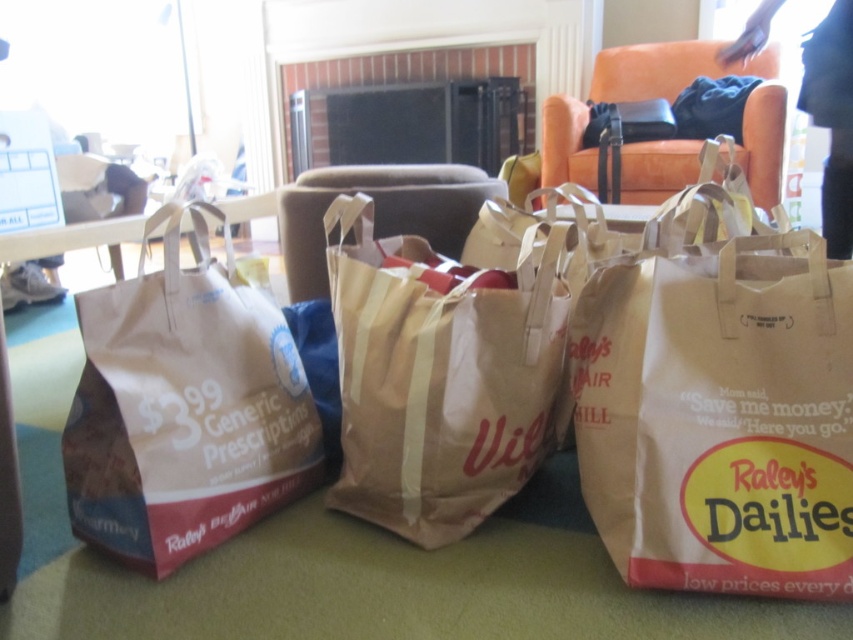
You are standing in the living room and see the brown paper bag at left. Can you tell me its exact position in the image?

The brown paper bag at left is located at the 2D coordinates of point (184, 404).

You are standing in a living room with two grocery bags on the green carpeted floor. You need to pick up the brown paper bag at left and the brown paper bag at center. Which one should you reach for first to grab the nearest one?

The brown paper bag at left is closer to the viewer, so you should reach for it first to grab the nearest one.

You are organizing groceries in a living room with a green carpeted floor. You have two grocery bags to place on the floor. The first is a brown paper bag at left with a red and white design advertising Generic Prescriptions for 3.99 and Raley s at the bottom. The second is a brown paper bag at center with the text Village in red letters. If you want to place a third bag to the right of the second bag, where should you position it relative to the existing bags?

The third bag should be placed to the right of the brown paper bag at center, as the brown paper bag at left is already positioned to the left of the brown paper bag at center.